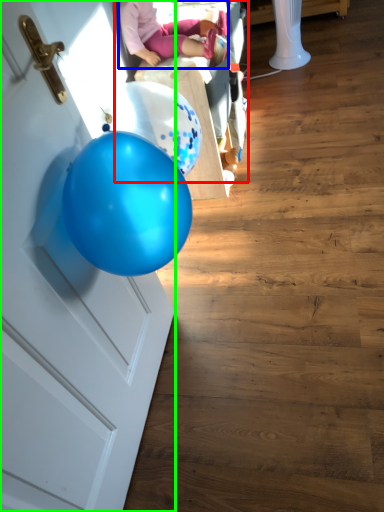
Question: Which object is positioned closest to baby carriage (highlighted by a red box)? Select from person (highlighted by a blue box) and door (highlighted by a green box).

Choices:
 (A) person
 (B) door

Answer: (A)